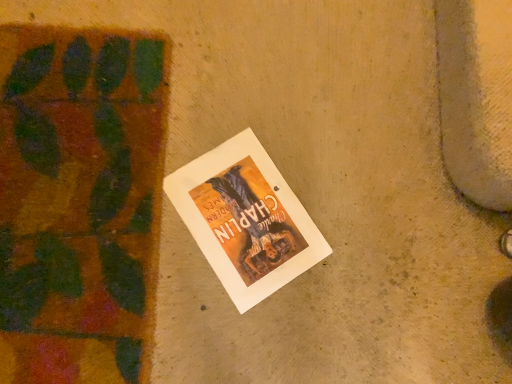
Locate an element on the screen. This screenshot has width=512, height=384. vacant space situated above white paper poster at center (from a real-world perspective) is located at coordinates (242, 215).